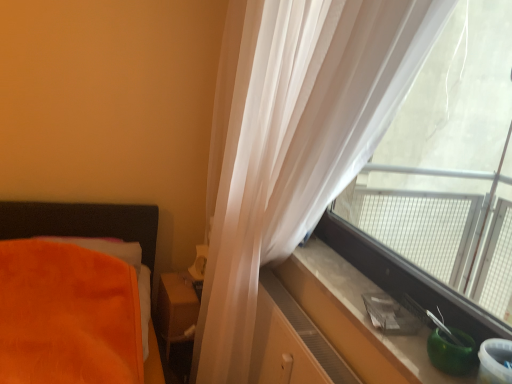
Measure the distance between point (196, 304) and camera.

A distance of 2.00 meters exists between point (196, 304) and camera.

What do you see at coordinates (441, 178) in the screenshot? The image size is (512, 384). I see `transparent plastic window at right` at bounding box center [441, 178].

You are a GUI agent. You are given a task and a screenshot of the screen. Output one action in this format:
    pyautogui.click(x=<x>, y=<y>)
    Task: Click on the translucent white curtain at upper right
    The height and width of the screenshot is (384, 512).
    Given the screenshot: What is the action you would take?
    pyautogui.click(x=296, y=143)

From a real-world perspective, which object rests below the other?

From a 3D spatial view, smooth concrete window sill at right is below.

Considering the points (309, 23) and (327, 300), which point is behind, point (309, 23) or point (327, 300)?

The point (327, 300) is behind.

Locate an element on the screen. window sill that is behind the translucent white curtain at upper right is located at coordinates (356, 319).

Are translucent white curtain at upper right and smooth concrete window sill at right located far from each other?

No, translucent white curtain at upper right is in close proximity to smooth concrete window sill at right.

Considering the points (189, 301) and (277, 359), which point is in front, point (189, 301) or point (277, 359)?

Point (277, 359)

Would you say matte brown wooden table at center is inside or outside matte wood dresser at lower right?

matte brown wooden table at center is spatially situated outside matte wood dresser at lower right.

Could you tell me if matte brown wooden table at center is facing matte wood dresser at lower right?

Yes, matte brown wooden table at center is facing matte wood dresser at lower right.

Do you think smooth concrete window sill at right is within matte brown wooden table at center, or outside of it?

smooth concrete window sill at right is not inside matte brown wooden table at center, it's outside.

Looking at this image, between smooth concrete window sill at right and matte brown wooden table at center, which one has smaller size?

smooth concrete window sill at right is smaller.

Is smooth concrete window sill at right positioned in front of matte brown wooden table at center?

Yes, smooth concrete window sill at right is closer to the camera.

From a real-world perspective, relative to matte brown wooden table at center, is smooth concrete window sill at right vertically above or below?

smooth concrete window sill at right is above matte brown wooden table at center.

Is matte brown wooden table at center next to smooth concrete window sill at right?

matte brown wooden table at center and smooth concrete window sill at right are not in contact.

From a real-world perspective, is matte brown wooden table at center on smooth concrete window sill at right?

No, from a real-world perspective, matte brown wooden table at center is not above smooth concrete window sill at right.

Between matte brown wooden table at center and smooth concrete window sill at right, which one has larger width?

Wider between the two is matte brown wooden table at center.

Is matte brown wooden table at center facing away from smooth concrete window sill at right?

No, matte brown wooden table at center's orientation is not away from smooth concrete window sill at right.

From the image's perspective, is smooth concrete window sill at right positioned above or below matte wood dresser at lower right?

From the image's perspective, smooth concrete window sill at right appears above matte wood dresser at lower right.

Do you think smooth concrete window sill at right is within matte wood dresser at lower right, or outside of it?

smooth concrete window sill at right is located beyond the bounds of matte wood dresser at lower right.

Can you confirm if smooth concrete window sill at right is positioned to the right of matte wood dresser at lower right?

Yes.

Does smooth concrete window sill at right have a greater height compared to matte wood dresser at lower right?

Incorrect, the height of smooth concrete window sill at right is not larger of that of matte wood dresser at lower right.

Is matte brown wooden table at center wider than transparent plastic window at right?

Yes.

Does matte brown wooden table at center turn towards transparent plastic window at right?

No, matte brown wooden table at center does not turn towards transparent plastic window at right.

From the image's perspective, is matte brown wooden table at center located above or below transparent plastic window at right?

matte brown wooden table at center is situated lower than transparent plastic window at right in the image.

Would you say smooth concrete window sill at right is outside transparent plastic window at right?

Yes, smooth concrete window sill at right is outside of transparent plastic window at right.

From the image's perspective, is smooth concrete window sill at right above or below transparent plastic window at right?

smooth concrete window sill at right is situated lower than transparent plastic window at right in the image.

Can you confirm if smooth concrete window sill at right is bigger than transparent plastic window at right?

Incorrect, smooth concrete window sill at right is not larger than transparent plastic window at right.

Find the location of a particular element. curtain located on the left of smooth concrete window sill at right is located at coordinates (296, 143).

The height and width of the screenshot is (384, 512). I want to click on dresser below the matte brown wooden table at center (from the image's perspective), so tap(291, 342).

From the image, which object appears to be farther from translucent white curtain at upper right, smooth concrete window sill at right or transparent plastic window at right?

Based on the image, transparent plastic window at right appears to be further to translucent white curtain at upper right.

Looking at the image, which one is located further to matte brown wooden table at center, smooth concrete window sill at right or translucent white curtain at upper right?

smooth concrete window sill at right is further to matte brown wooden table at center.

Based on their spatial positions, is smooth concrete window sill at right or matte wood dresser at lower right closer to translucent white curtain at upper right?

matte wood dresser at lower right.

Estimate the real-world distances between objects in this image. Which object is closer to matte wood dresser at lower right, transparent plastic window at right or smooth concrete window sill at right?

Based on the image, smooth concrete window sill at right appears to be nearer to matte wood dresser at lower right.

Based on their spatial positions, is transparent plastic window at right or matte wood dresser at lower right closer to matte brown wooden table at center?

matte wood dresser at lower right.

Estimate the real-world distances between objects in this image. Which object is further from transparent plastic window at right, smooth concrete window sill at right or matte wood dresser at lower right?

matte wood dresser at lower right.

In the scene shown: Based on their spatial positions, is transparent plastic window at right or smooth concrete window sill at right closer to matte brown wooden table at center?

Among the two, smooth concrete window sill at right is located nearer to matte brown wooden table at center.

From the image, which object appears to be nearer to smooth concrete window sill at right, matte wood dresser at lower right or matte brown wooden table at center?

Based on the image, matte wood dresser at lower right appears to be nearer to smooth concrete window sill at right.

The image size is (512, 384). I want to click on window sill between translucent white curtain at upper right and matte brown wooden table at center from front to back, so click(x=356, y=319).

Where is `window sill between translucent white curtain at upper right and matte wood dresser at lower right along the z-axis`? window sill between translucent white curtain at upper right and matte wood dresser at lower right along the z-axis is located at coordinates (356, 319).

Locate an element on the screen. dresser between translucent white curtain at upper right and matte brown wooden table at center from front to back is located at coordinates (291, 342).

Locate an element on the screen. The width and height of the screenshot is (512, 384). window located between translucent white curtain at upper right and matte brown wooden table at center in the depth direction is located at coordinates (441, 178).